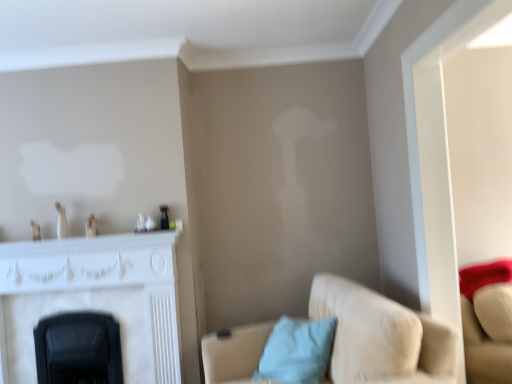
Question: Is there a large distance between light blue fabric pillow at lower center and white marble fireplace at left?

Choices:
 (A) no
 (B) yes

Answer: (A)

Question: From a real-world perspective, is light blue fabric pillow at lower center physically above white marble fireplace at left?

Choices:
 (A) yes
 (B) no

Answer: (B)

Question: Considering the relative sizes of light blue fabric pillow at lower center and white marble fireplace at left in the image provided, is light blue fabric pillow at lower center shorter than white marble fireplace at left?

Choices:
 (A) no
 (B) yes

Answer: (B)

Question: Does light blue fabric pillow at lower center lie behind white marble fireplace at left?

Choices:
 (A) no
 (B) yes

Answer: (A)

Question: From the image's perspective, is light blue fabric pillow at lower center over white marble fireplace at left?

Choices:
 (A) no
 (B) yes

Answer: (A)

Question: Does point (276, 344) appear closer or farther from the camera than point (160, 362)?

Choices:
 (A) farther
 (B) closer

Answer: (B)

Question: Is light blue fabric pillow at lower center situated inside white marble fireplace at left or outside?

Choices:
 (A) inside
 (B) outside

Answer: (B)

Question: Considering the positions of light blue fabric pillow at lower center and white marble fireplace at left in the image, is light blue fabric pillow at lower center taller or shorter than white marble fireplace at left?

Choices:
 (A) short
 (B) tall

Answer: (A)

Question: Based on their positions, is light blue fabric pillow at lower center located to the left or right of white marble fireplace at left?

Choices:
 (A) right
 (B) left

Answer: (A)

Question: From the image's perspective, relative to suede beige couch at lower right, is white marble fireplace at left above or below?

Choices:
 (A) above
 (B) below

Answer: (A)

Question: In the image, is white marble fireplace at left on the left side or the right side of suede beige couch at lower right?

Choices:
 (A) right
 (B) left

Answer: (B)

Question: From a real-world perspective, is white marble fireplace at left positioned above or below suede beige couch at lower right?

Choices:
 (A) above
 (B) below

Answer: (A)

Question: Is white marble fireplace at left situated inside suede beige couch at lower right or outside?

Choices:
 (A) inside
 (B) outside

Answer: (B)

Question: Considering the positions of white marble fireplace at left and light blue fabric pillow at lower center in the image, is white marble fireplace at left bigger or smaller than light blue fabric pillow at lower center?

Choices:
 (A) small
 (B) big

Answer: (B)

Question: Is white marble fireplace at left wider or thinner than light blue fabric pillow at lower center?

Choices:
 (A) wide
 (B) thin

Answer: (B)